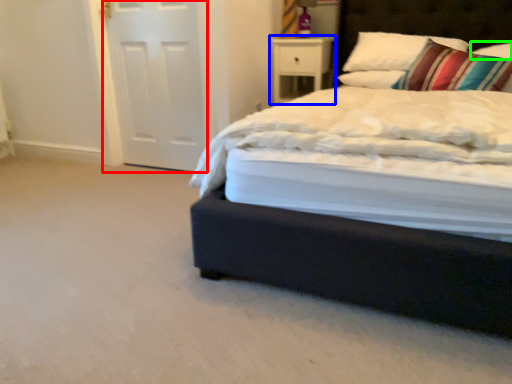
Question: Based on their relative distances, which object is farther from screen door (highlighted by a red box)? Choose from nightstand (highlighted by a blue box) and pillow (highlighted by a green box).

Choices:
 (A) nightstand
 (B) pillow

Answer: (B)